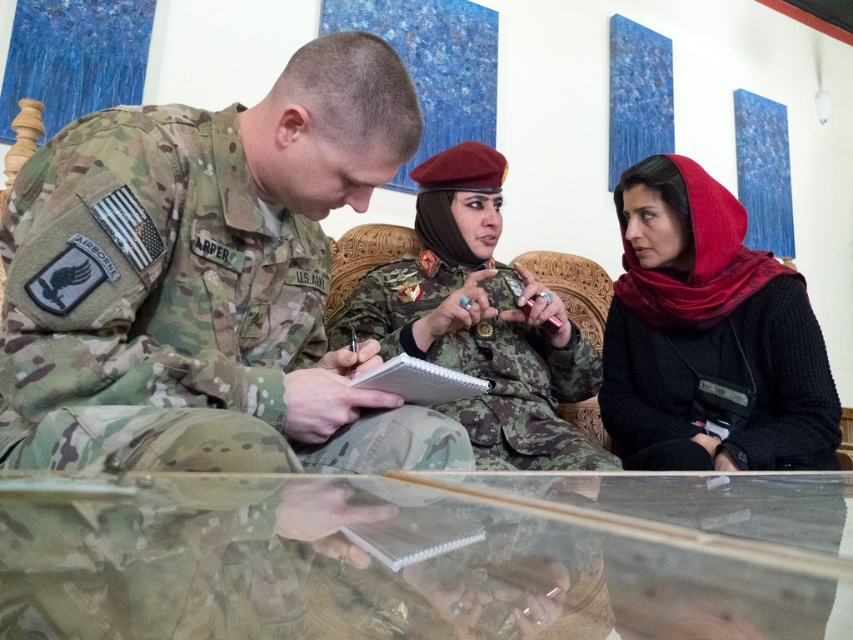
Is point (277, 520) farther from camera compared to point (496, 433)?

No, it is in front of (496, 433).

Who is more distant from viewer, (500, 598) or (613, 461)?

The point (613, 461) is behind.

Where is `transparent glass table at center`? transparent glass table at center is located at coordinates point(428,557).

Looking at this image, can you confirm if camouflage uniform at center is positioned to the left of transparent glass table at center?

Correct, you'll find camouflage uniform at center to the left of transparent glass table at center.

Is camouflage uniform at center shorter than transparent glass table at center?

Incorrect, camouflage uniform at center's height does not fall short of transparent glass table at center's.

Who is more forward, (144, 156) or (137, 515)?

Point (137, 515) is more forward.

Find the location of a particular element. This screenshot has width=853, height=640. camouflage uniform at center is located at coordinates (207, 282).

Between camouflage fabric uniform at center and white paper clipboard at center, which one has more height?

camouflage fabric uniform at center

Can you confirm if camouflage fabric uniform at center is smaller than white paper clipboard at center?

No, camouflage fabric uniform at center is not smaller than white paper clipboard at center.

Identify the location of camouflage fabric uniform at center. (480, 321).